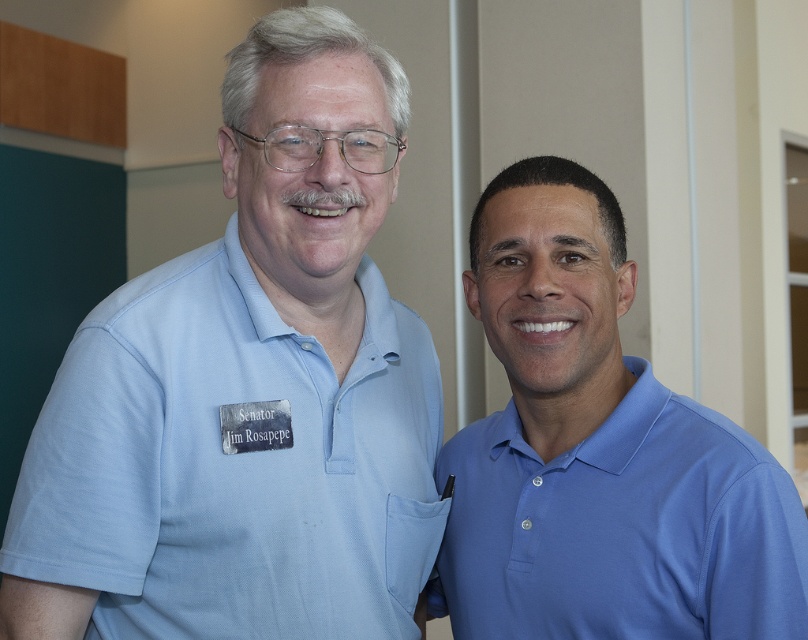
Between light blue polo shirt at left and blue smooth polo shirt at right, which one appears on the right side from the viewer's perspective?

blue smooth polo shirt at right

In the scene shown: Is light blue polo shirt at left positioned behind blue smooth polo shirt at right?

Yes, it is behind blue smooth polo shirt at right.

Who is more distant from viewer, (363, 461) or (806, 582)?

Point (363, 461)

Image resolution: width=808 pixels, height=640 pixels. I want to click on light blue polo shirt at left, so pyautogui.click(x=247, y=388).